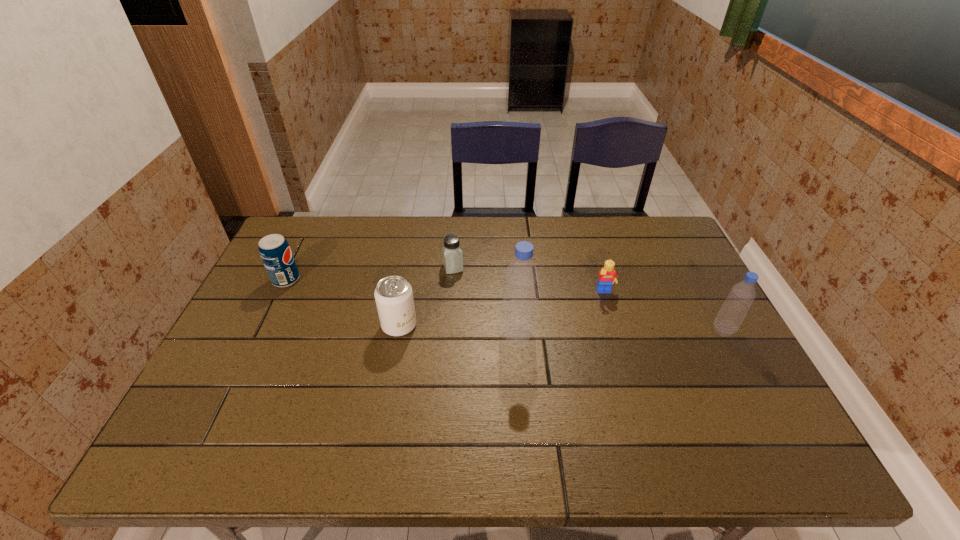
Find the location of a particular element. This screenshot has height=540, width=960. the fourth object from left to right is located at coordinates (518, 320).

Where is `the left bottle`? This screenshot has width=960, height=540. the left bottle is located at coordinates (518, 320).

Locate an element on the screen. the right bottle is located at coordinates (733, 311).

The width and height of the screenshot is (960, 540). Identify the location of the rightmost object. (733, 311).

Locate an element on the screen. the third object from left to right is located at coordinates (452, 256).

What are the coordinates of `the left soda can` in the screenshot? It's located at (275, 252).

Identify the location of the farther soda can. This screenshot has width=960, height=540. (275, 252).

Identify the location of the second object from left to right. The image size is (960, 540). (394, 299).

I want to click on the right soda can, so click(394, 299).

Locate an element on the screen. Lego is located at coordinates (607, 276).